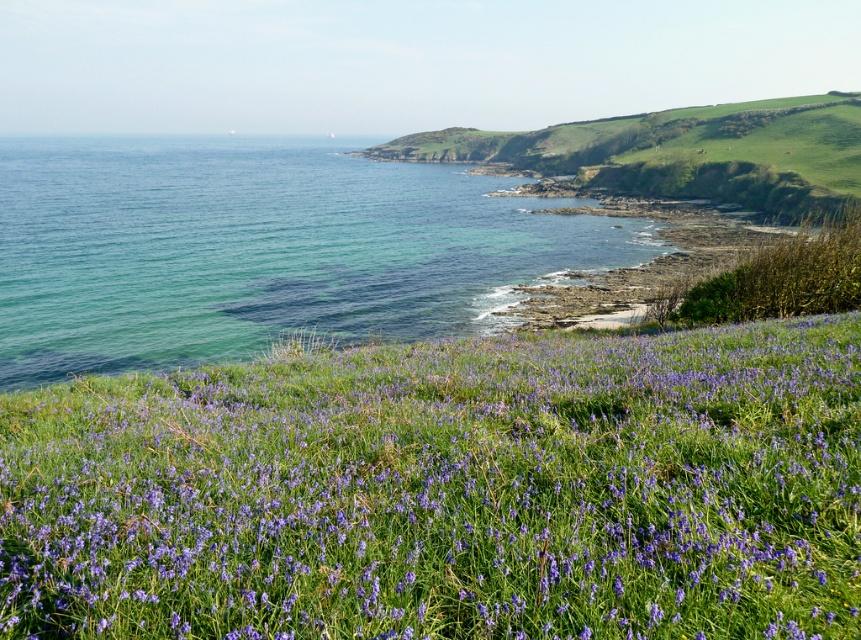
Question: Which point is farther to the camera?

Choices:
 (A) (351, 538)
 (B) (0, 353)

Answer: (B)

Question: Which object is farther from the camera taking this photo?

Choices:
 (A) purple grass at center
 (B) clear blue water at left

Answer: (B)

Question: Can you confirm if purple grass at center is positioned to the left of clear blue water at left?

Choices:
 (A) yes
 (B) no

Answer: (B)

Question: Does purple grass at center appear over clear blue water at left?

Choices:
 (A) no
 (B) yes

Answer: (A)

Question: Does purple grass at center appear under clear blue water at left?

Choices:
 (A) yes
 (B) no

Answer: (A)